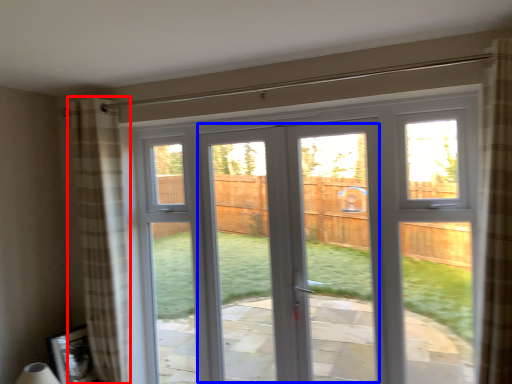
Question: Which point is closer to the camera, curtain (highlighted by a red box) or screen door (highlighted by a blue box)?

Choices:
 (A) curtain
 (B) screen door

Answer: (B)